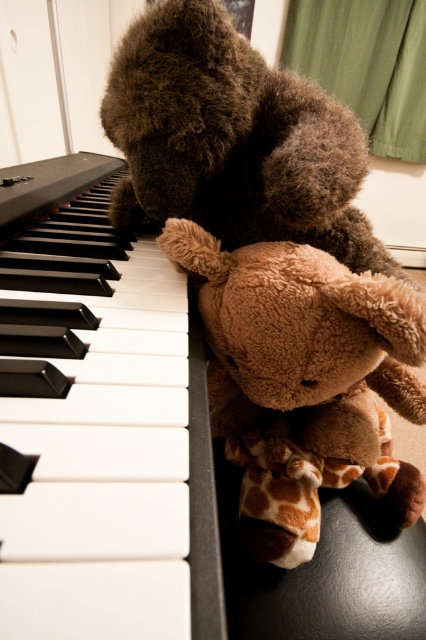
Question: Can you confirm if black matte piano keys at left is positioned below brown plush teddy bear at center?

Choices:
 (A) yes
 (B) no

Answer: (B)

Question: Can you confirm if black matte piano keys at left is positioned above brown plush teddy bear at center?

Choices:
 (A) yes
 (B) no

Answer: (A)

Question: Which object is closer to the camera taking this photo?

Choices:
 (A) brown plush teddy bear at center
 (B) black matte piano keys at left

Answer: (B)

Question: Does black matte piano keys at left have a larger size compared to brown plush teddy bear at center?

Choices:
 (A) yes
 (B) no

Answer: (A)

Question: Which point is farther to the camera?

Choices:
 (A) black matte piano keys at left
 (B) brown plush teddy bear at center

Answer: (B)